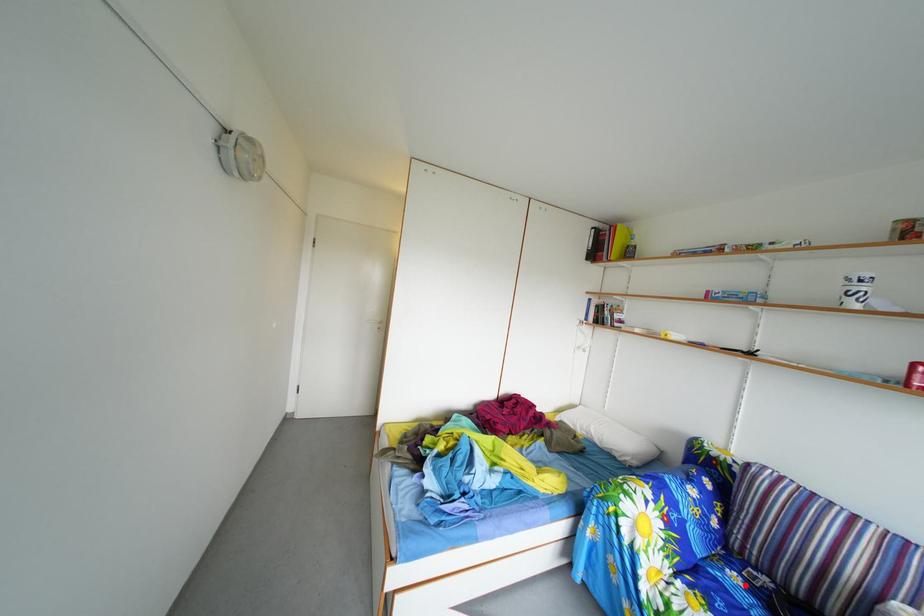
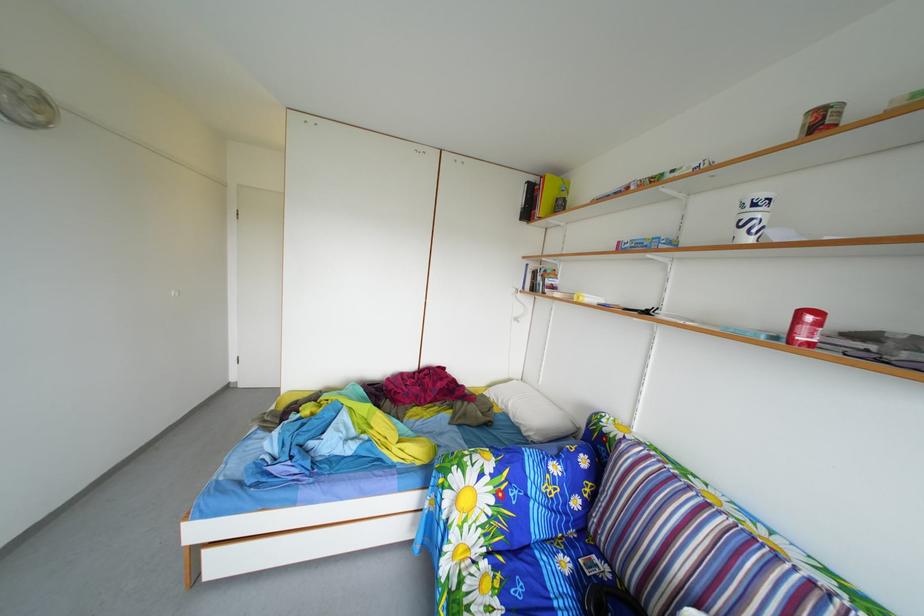
Where in the second image is the point corresponding to the highlighted location from the first image?

(576, 570)